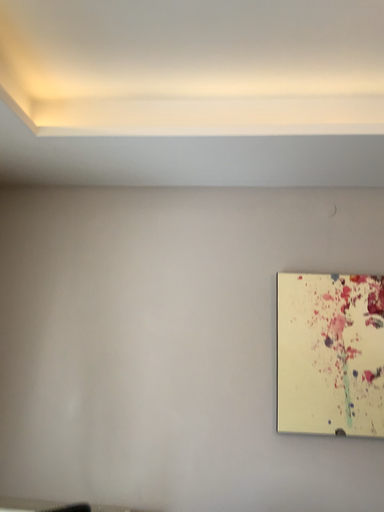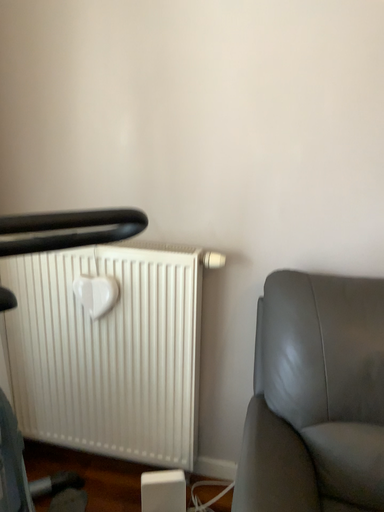
Question: Which way did the camera rotate in the video?

Choices:
 (A) rotated upward
 (B) rotated downward

Answer: (B)